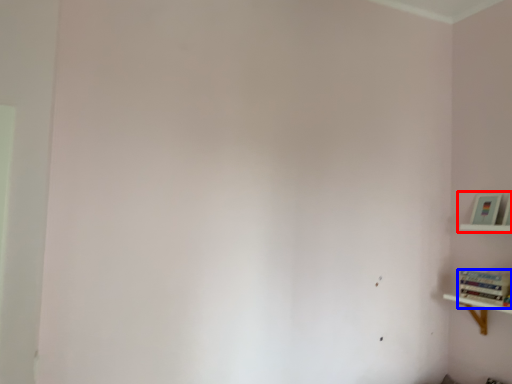
Question: Which object is closer to the camera taking this photo, shelf (highlighted by a red box) or book (highlighted by a blue box)?

Choices:
 (A) shelf
 (B) book

Answer: (B)